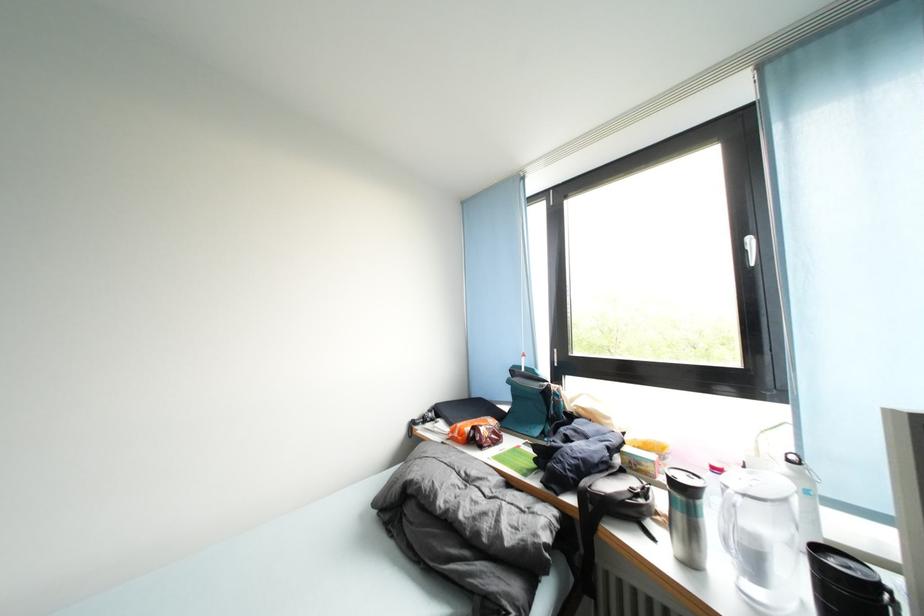
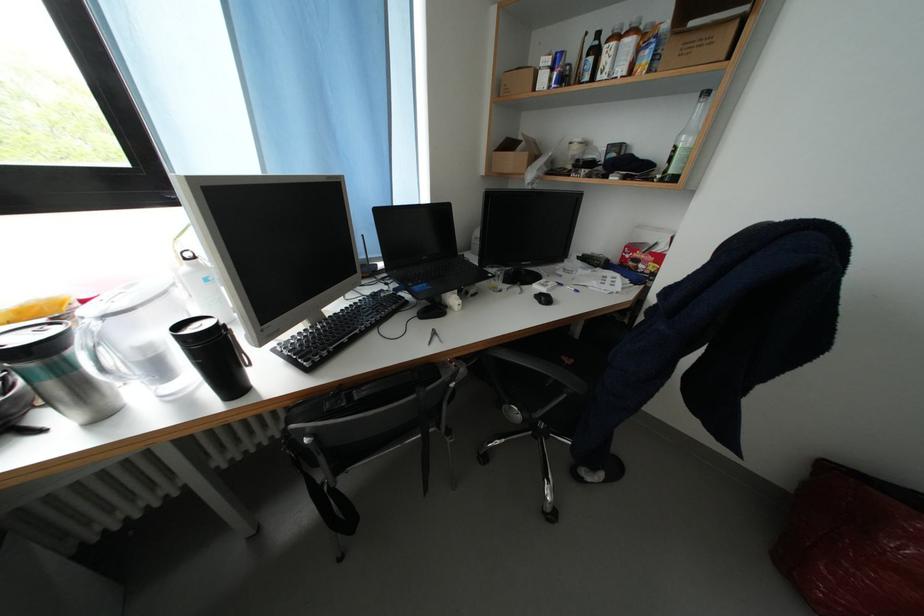
Based on the continuous images, in which direction is the camera rotating?

The camera rotated toward right-down.